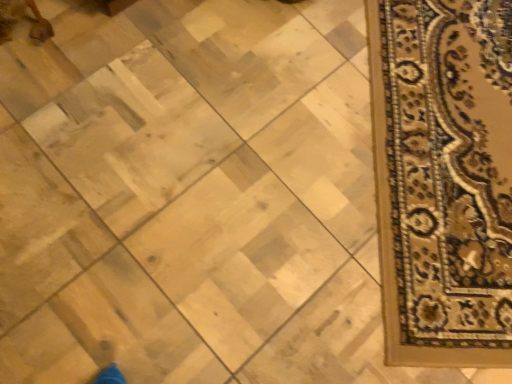
Image resolution: width=512 pixels, height=384 pixels. I want to click on carpet with intricate patterns at right, so click(x=443, y=178).

This screenshot has width=512, height=384. What do you see at coordinates (443, 178) in the screenshot?
I see `carpet with intricate patterns at right` at bounding box center [443, 178].

Measure the distance between carpet with intricate patterns at right and camera.

They are 3.34 feet apart.

In order to face carpet with intricate patterns at right, should I rotate leftwards or rightwards?

It's best to rotate right around 25.575 degrees.

What are the coordinates of `carpet with intricate patterns at right` in the screenshot? It's located at (443, 178).